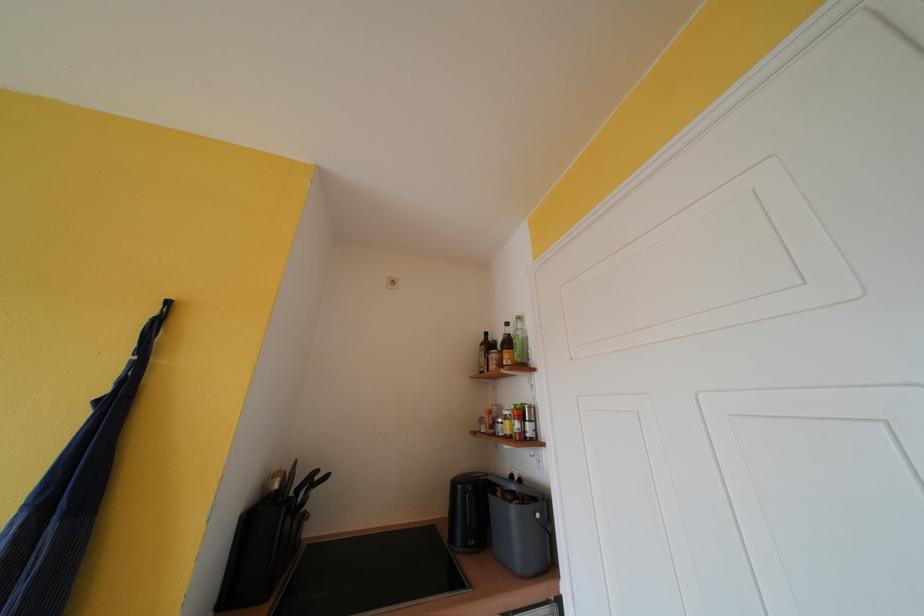
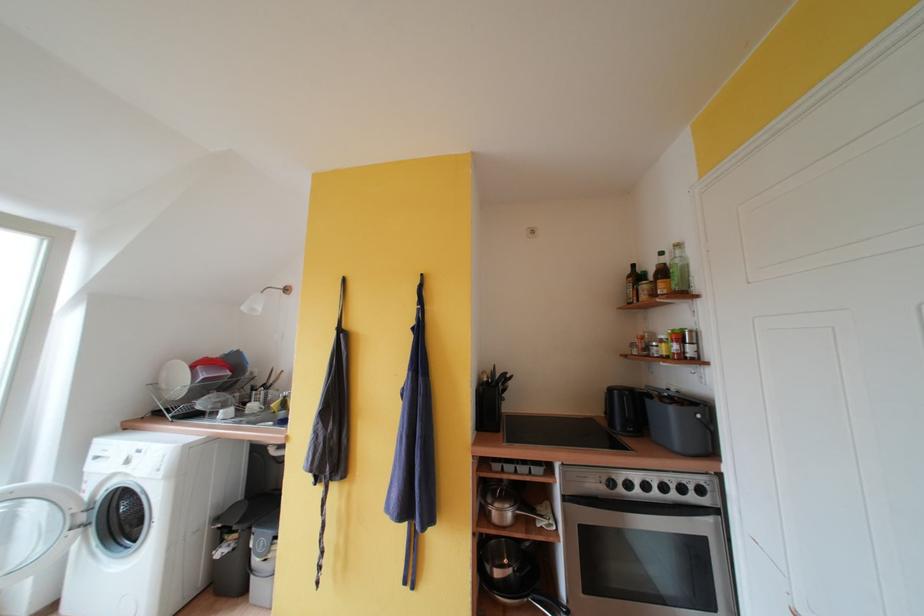
Locate, in the second image, the point that corresponds to [435,535] in the first image.

(594, 424)